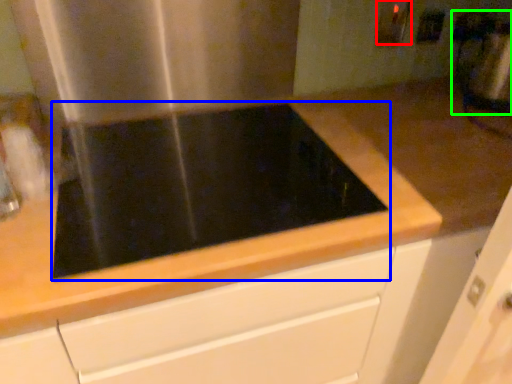
Question: Considering the real-world distances, which object is farthest from electric outlet (highlighted by a red box)? gas stove (highlighted by a blue box) or blender (highlighted by a green box)?

Choices:
 (A) gas stove
 (B) blender

Answer: (A)